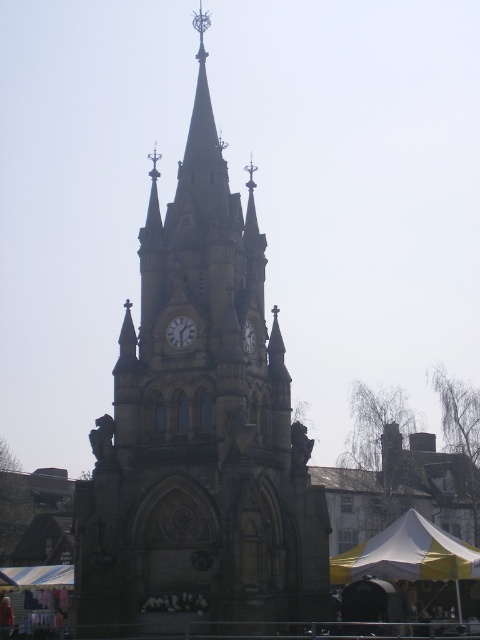
You are standing at the center of a square in front of the stone clock tower at center. If you walk directly towards the tower, which direction should you face?

Since the stone clock tower at center is positioned at point (200, 428), you should face north to walk directly towards it.